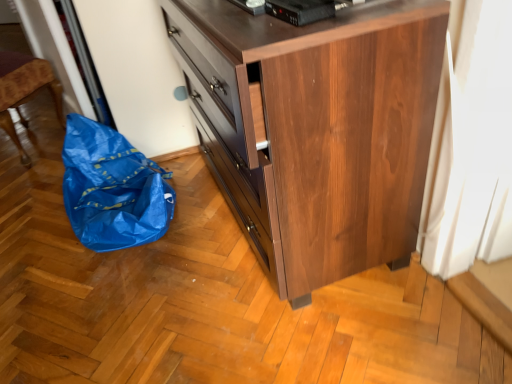
The image size is (512, 384). In order to click on blue plastic bag at left in this screenshot , I will do `click(24, 91)`.

The width and height of the screenshot is (512, 384). In order to click on brown wood chest of drawers at center in this screenshot , I will do `click(317, 128)`.

What do you see at coordinates (317, 128) in the screenshot? Image resolution: width=512 pixels, height=384 pixels. I see `brown wood chest of drawers at center` at bounding box center [317, 128].

Where is `blue plastic bag at left`? blue plastic bag at left is located at coordinates (24, 91).

Considering the sizes of blue plastic bag at left and black plastic device at upper center in the image, is blue plastic bag at left taller or shorter than black plastic device at upper center?

In the image, blue plastic bag at left appears to be taller than black plastic device at upper center.

From a real-world perspective, is blue plastic bag at left positioned above or below black plastic device at upper center?

blue plastic bag at left is situated lower than black plastic device at upper center in the real world.

Considering the points (14, 62) and (275, 12), which point is behind, point (14, 62) or point (275, 12)?

Positioned behind is point (14, 62).

Is black plastic device at upper center shorter than blue plastic bag at left?

Correct, black plastic device at upper center is not as tall as blue plastic bag at left.

Is black plastic device at upper center positioned far away from blue plastic bag at left?

Yes, black plastic device at upper center and blue plastic bag at left are located far from each other.

Considering their positions, is black plastic device at upper center located in front of or behind blue plastic bag at left?

In the image, black plastic device at upper center appears in front of blue plastic bag at left.

Considering the sizes of objects black plastic device at upper center and blue plastic bag at left in the image provided, who is thinner, black plastic device at upper center or blue plastic bag at left?

black plastic device at upper center is thinner.

What's the angular difference between brown wood chest of drawers at center and black plastic device at upper center's facing directions?

They differ by 3.72 degrees in their facing directions.

Which object is positioned more to the right, brown wood chest of drawers at center or black plastic device at upper center?

black plastic device at upper center is more to the right.

Does brown wood chest of drawers at center turn towards black plastic device at upper center?

No, brown wood chest of drawers at center is not aimed at black plastic device at upper center.

Between point (359, 219) and point (319, 7), which one is positioned in front?

Point (319, 7)

Is black plastic device at upper center outside of brown wood chest of drawers at center?

Indeed, black plastic device at upper center is completely outside brown wood chest of drawers at center.

How different are the orientations of black plastic device at upper center and brown wood chest of drawers at center in degrees?

3.72 degrees separate the facing orientations of black plastic device at upper center and brown wood chest of drawers at center.

Could you tell me if black plastic device at upper center is turned towards brown wood chest of drawers at center?

No, black plastic device at upper center is not aimed at brown wood chest of drawers at center.

Considering the sizes of objects black plastic device at upper center and brown wood chest of drawers at center in the image provided, who is taller, black plastic device at upper center or brown wood chest of drawers at center?

brown wood chest of drawers at center.

Would you consider blue plastic bag at left to be distant from brown wood chest of drawers at center?

blue plastic bag at left is positioned a significant distance from brown wood chest of drawers at center.

Which of these two, blue plastic bag at left or brown wood chest of drawers at center, stands taller?

brown wood chest of drawers at center.

Can you tell me how much blue plastic bag at left and brown wood chest of drawers at center differ in facing direction?

The angular difference between blue plastic bag at left and brown wood chest of drawers at center is 49.1 degrees.

How much distance is there between brown wood chest of drawers at center and blue plastic bag at left?

brown wood chest of drawers at center is 1.45 meters from blue plastic bag at left.

Is brown wood chest of drawers at center to the left or to the right of blue plastic bag at left in the image?

brown wood chest of drawers at center is positioned on blue plastic bag at left's right side.

Which is more distant, (199, 63) or (47, 66)?

The point (47, 66) is farther.

From the image's perspective, does brown wood chest of drawers at center appear higher than blue plastic bag at left?

A: No, from the image's perspective, brown wood chest of drawers at center is not on top of blue plastic bag at left.

Locate an element on the screen. Image resolution: width=512 pixels, height=384 pixels. furniture below the black plastic device at upper center (from a real-world perspective) is located at coordinates (24, 91).

The image size is (512, 384). What are the coordinates of `appliance below the blue plastic bag at left (from the image's perspective)` in the screenshot? It's located at (300, 10).

Which object lies further to the anchor point brown wood chest of drawers at center, black plastic device at upper center or blue plastic bag at left?

Among the two, blue plastic bag at left is located further to brown wood chest of drawers at center.

Looking at the image, which one is located closer to black plastic device at upper center, blue plastic bag at left or brown wood chest of drawers at center?

brown wood chest of drawers at center is closer to black plastic device at upper center.

Based on the photo, which object lies further to the anchor point black plastic device at upper center, brown wood chest of drawers at center or blue plastic bag at left?

The object further to black plastic device at upper center is blue plastic bag at left.

Based on their spatial positions, is black plastic device at upper center or brown wood chest of drawers at center closer to blue plastic bag at left?

brown wood chest of drawers at center is positioned closer to the anchor blue plastic bag at left.

Looking at the image, which one is located further to brown wood chest of drawers at center, blue plastic bag at left or black plastic device at upper center?

Based on the image, blue plastic bag at left appears to be further to brown wood chest of drawers at center.

Which object lies nearer to the anchor point blue plastic bag at left, brown wood chest of drawers at center or black plastic device at upper center?

Based on the image, brown wood chest of drawers at center appears to be nearer to blue plastic bag at left.

This screenshot has height=384, width=512. Identify the location of chest of drawers between blue plastic bag at left and black plastic device at upper center in the horizontal direction. (317, 128).